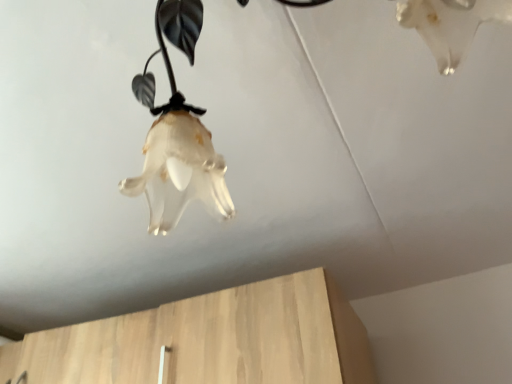
I want to click on translucent glass lamp at upper center, so click(x=177, y=133).

Describe the element at coordinates (177, 133) in the screenshot. I see `translucent glass lamp at upper center` at that location.

You are a GUI agent. You are given a task and a screenshot of the screen. Output one action in this format:
    pyautogui.click(x=<x>, y=<y>)
    Task: Click on the translucent glass lamp at upper center
    The height and width of the screenshot is (384, 512).
    Given the screenshot: What is the action you would take?
    pyautogui.click(x=177, y=133)